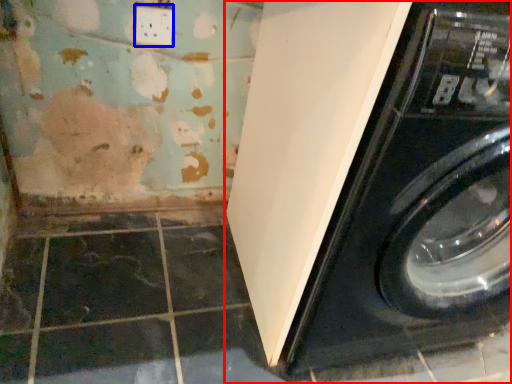
Question: Which point is closer to the camera, washing machine (highlighted by a red box) or electric outlet (highlighted by a blue box)?

Choices:
 (A) washing machine
 (B) electric outlet

Answer: (A)